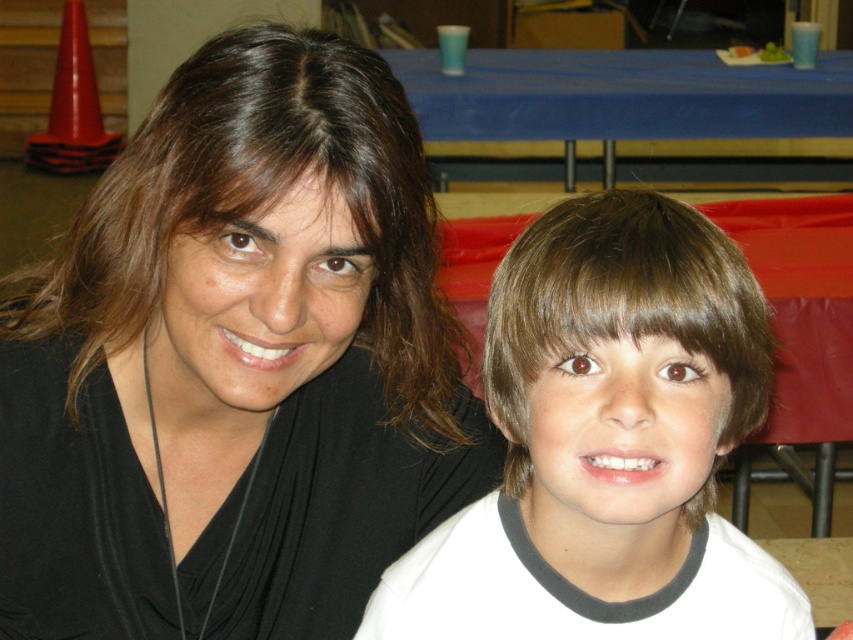
Question: Is black matte hair at upper left to the left of brown hair at center from the viewer's perspective?

Choices:
 (A) yes
 (B) no

Answer: (A)

Question: Among these points, which one is nearest to the camera?

Choices:
 (A) (136, 547)
 (B) (585, 596)

Answer: (B)

Question: Is black matte hair at upper left wider than brown hair at center?

Choices:
 (A) no
 (B) yes

Answer: (B)

Question: Can you confirm if black matte hair at upper left is wider than brown hair at center?

Choices:
 (A) yes
 (B) no

Answer: (A)